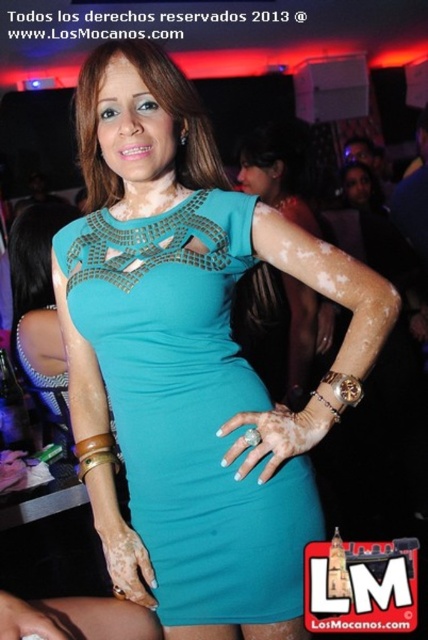
What do you see at coordinates (190, 408) in the screenshot?
I see `teal jersey dress at center` at bounding box center [190, 408].

Which is in front, point (258, 621) or point (294, 384)?

Point (258, 621)

Between point (136, 236) and point (309, 316), which one is positioned behind?

The point (309, 316) is behind.

Find the location of a particular element. The height and width of the screenshot is (640, 428). teal jersey dress at center is located at coordinates (190, 408).